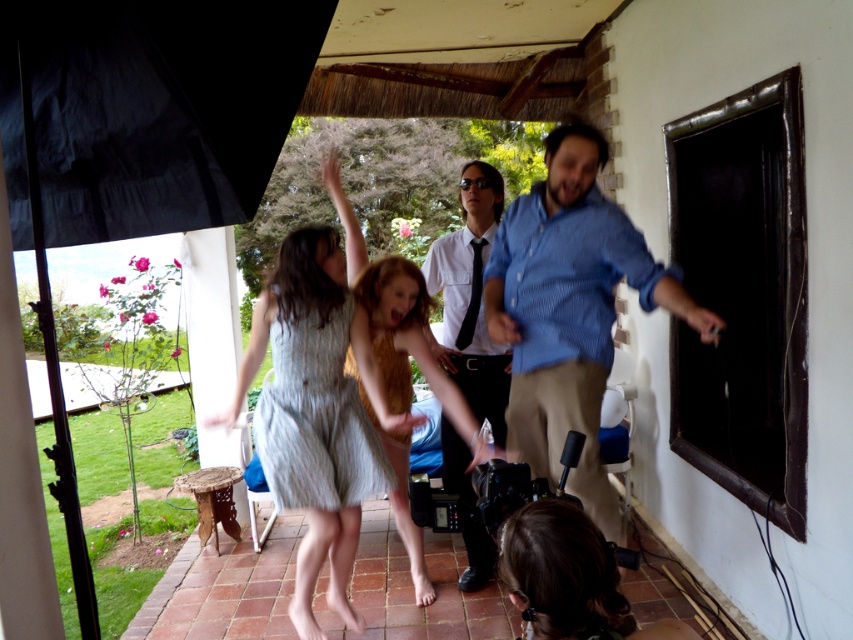
Question: Does white shirt at center have a larger size compared to light blue textured dress at center?

Choices:
 (A) yes
 (B) no

Answer: (A)

Question: Which point is farther to the camera?

Choices:
 (A) (573, 125)
 (B) (339, 333)

Answer: (B)

Question: Which object is positioned farthest from the striped cotton dress at center?

Choices:
 (A) blue striped shirt at center
 (B) gray striped dress at center
 (C) light brown hair at center

Answer: (A)

Question: Which point is closer to the camera?

Choices:
 (A) gray striped dress at center
 (B) blue striped shirt at center
 (C) light brown hair at center

Answer: (B)

Question: Does striped cotton dress at center have a greater width compared to light brown hair at center?

Choices:
 (A) no
 (B) yes

Answer: (A)

Question: Can you confirm if white shirt at center is positioned above light brown hair at center?

Choices:
 (A) yes
 (B) no

Answer: (A)